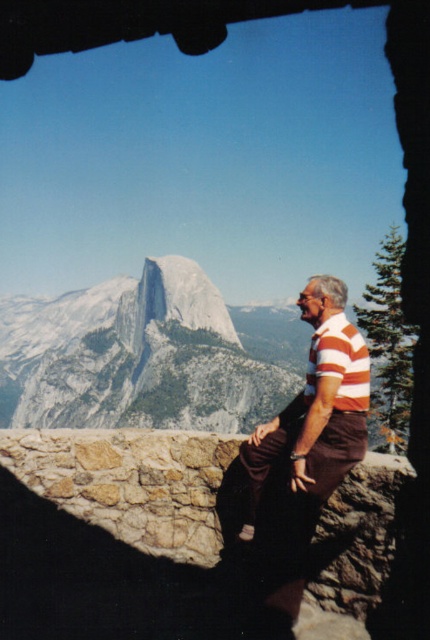
Looking at this image, you are a photographer planning to take a photo of the striped cotton shirt at right and the orange striped polo shirt at center. Which of the two shirts should be placed closer to the camera to ensure both are in focus without adjusting the lens?

The striped cotton shirt at right is taller than the orange striped polo shirt at center, so placing the orange striped polo shirt at center closer to the camera will help maintain focus on both shirts.

You are a photographer planning to capture a photo of the striped cotton shirt at right and the orange striped polo shirt at center. Based on their positions, which shirt would appear larger in the photo?

The orange striped polo shirt at center would appear larger in the photo because it is closer to the camera than the striped cotton shirt at right, which is further away.

Looking at this image, you are a photographer planning to take a picture of the mountain landscape. You notice a man wearing a striped cotton shirt at right in the scene. To ensure he doesn not block the view of Half Dome, where should you position him relative to the frame?

The striped cotton shirt at right is located at point (316, 406) in the frame. To avoid blocking Half Dome, you should move the man to a position further to the right so that he is outside the frame or positioned away from the central area where Half Dome is located.